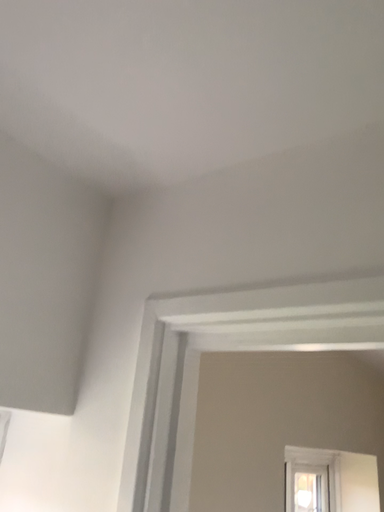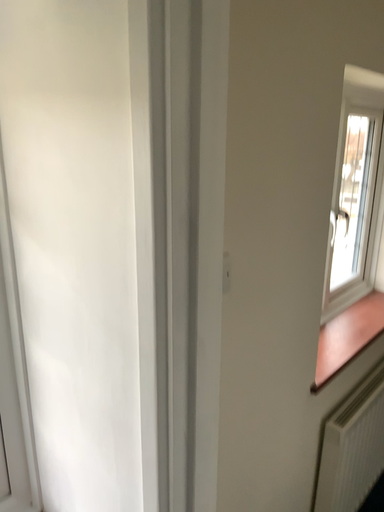
Question: Which way did the camera rotate in the video?

Choices:
 (A) rotated downward
 (B) rotated upward

Answer: (A)